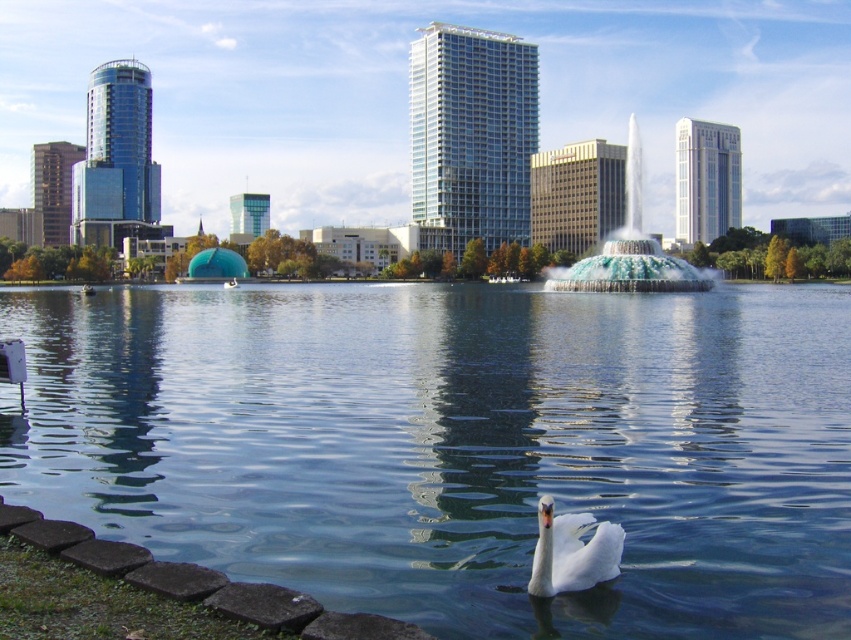
Question: Can you confirm if clear water at center is smaller than blue glass fountain at center?

Choices:
 (A) yes
 (B) no

Answer: (A)

Question: Which object is positioned closest to the clear water at center?

Choices:
 (A) white glossy swan at lower center
 (B) blue glass fountain at center

Answer: (A)

Question: Which point appears closest to the camera in this image?

Choices:
 (A) (560, 330)
 (B) (563, 269)

Answer: (A)

Question: Can you confirm if clear water at center is positioned below blue glass fountain at center?

Choices:
 (A) no
 (B) yes

Answer: (B)

Question: Which point is farther to the camera?

Choices:
 (A) white glossy swan at lower center
 (B) clear water at center
 (C) blue glass fountain at center

Answer: (C)

Question: Is clear water at center bigger than blue glass fountain at center?

Choices:
 (A) yes
 (B) no

Answer: (B)